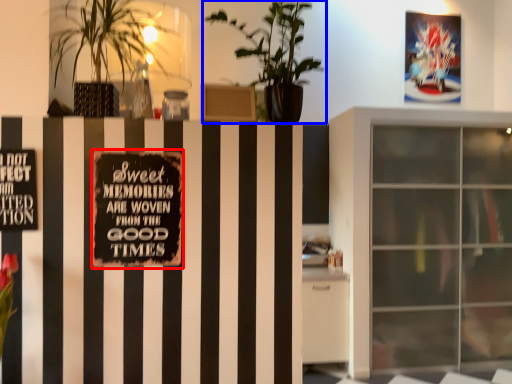
Question: Among these objects, which one is farthest to the camera, bulletin board (highlighted by a red box) or houseplant (highlighted by a blue box)?

Choices:
 (A) bulletin board
 (B) houseplant

Answer: (A)